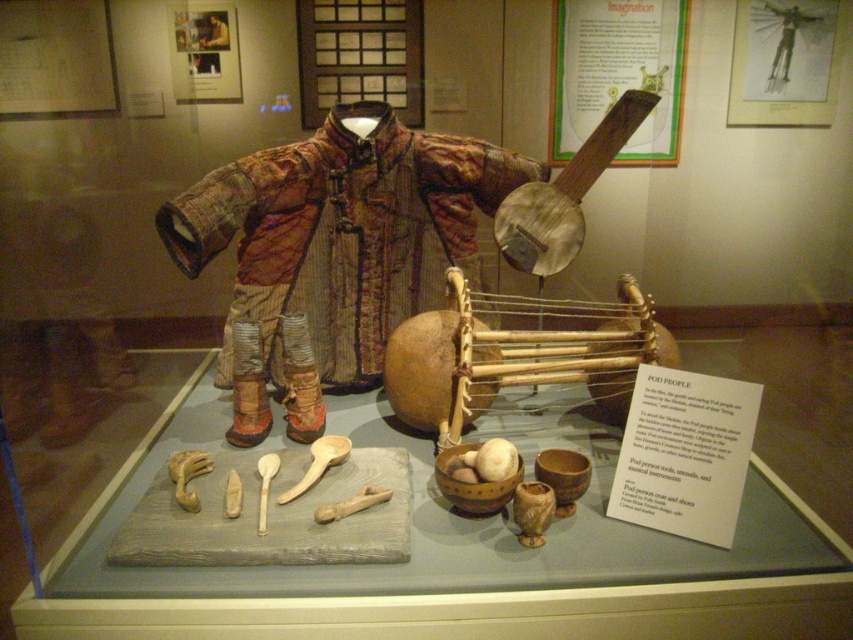
Does textured brown fabric coat at center appear on the left side of wooden banjo at upper center?

Indeed, textured brown fabric coat at center is positioned on the left side of wooden banjo at upper center.

Is textured brown fabric coat at center further to camera compared to wooden banjo at upper center?

No, textured brown fabric coat at center is in front of wooden banjo at upper center.

Does point (207, 209) come behind point (596, 170)?

No, (207, 209) is closer to viewer.

The width and height of the screenshot is (853, 640). Identify the location of textured brown fabric coat at center. (341, 234).